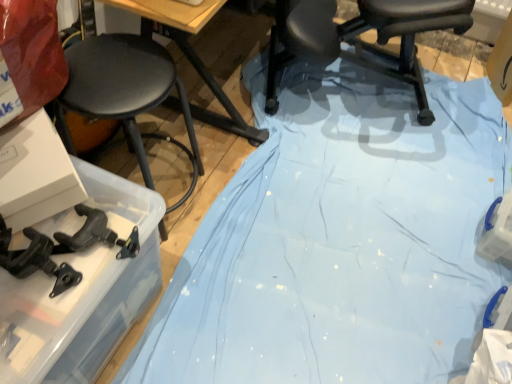
Question: From a real-world perspective, is black matte stool at left on top of wooden at upper center?

Choices:
 (A) yes
 (B) no

Answer: (B)

Question: From a real-world perspective, is black matte stool at left beneath wooden at upper center?

Choices:
 (A) no
 (B) yes

Answer: (B)

Question: Is black matte stool at left not close to wooden at upper center?

Choices:
 (A) yes
 (B) no

Answer: (B)

Question: Can you confirm if black matte stool at left is positioned to the right of wooden at upper center?

Choices:
 (A) no
 (B) yes

Answer: (A)

Question: Can you confirm if black matte stool at left is thinner than wooden at upper center?

Choices:
 (A) yes
 (B) no

Answer: (B)

Question: Is wooden at upper center located within black matte stool at left?

Choices:
 (A) no
 (B) yes

Answer: (A)

Question: Does wooden at upper center have a lesser height compared to black plastic chair at center?

Choices:
 (A) no
 (B) yes

Answer: (B)

Question: Considering the relative sizes of wooden at upper center and black plastic chair at center in the image provided, is wooden at upper center thinner than black plastic chair at center?

Choices:
 (A) no
 (B) yes

Answer: (B)

Question: Is wooden at upper center bigger than black plastic chair at center?

Choices:
 (A) no
 (B) yes

Answer: (A)

Question: Considering the relative sizes of wooden at upper center and black plastic chair at center in the image provided, is wooden at upper center smaller than black plastic chair at center?

Choices:
 (A) no
 (B) yes

Answer: (B)

Question: Can you confirm if wooden at upper center is taller than black plastic chair at center?

Choices:
 (A) no
 (B) yes

Answer: (A)

Question: Is wooden at upper center located outside black plastic chair at center?

Choices:
 (A) yes
 (B) no

Answer: (A)

Question: Could you tell me if black plastic chair at center is turned towards wooden at upper center?

Choices:
 (A) yes
 (B) no

Answer: (B)